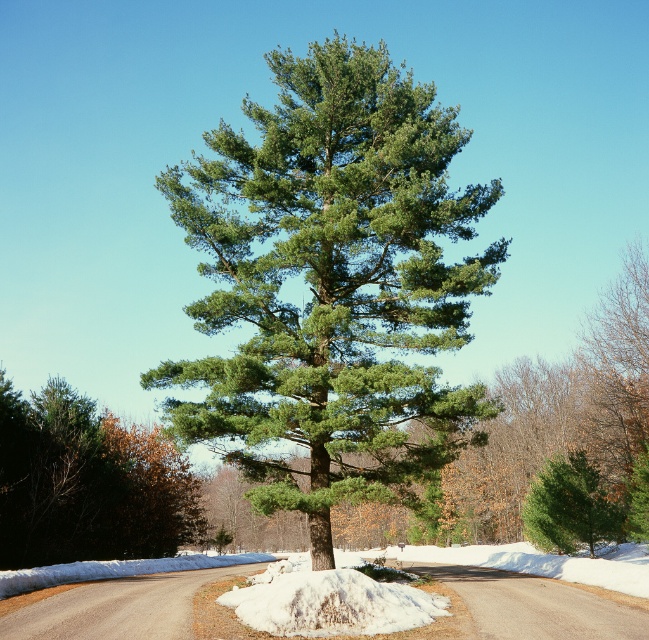
Is green matte tree at center to the right of green matte evergreen tree at center from the viewer's perspective?

Incorrect, green matte tree at center is not on the right side of green matte evergreen tree at center.

Is green matte tree at center closer to the viewer compared to green matte evergreen tree at center?

No, it is behind green matte evergreen tree at center.

At what (x,y) coordinates should I click in order to perform the action: click on green matte tree at center. Please return your answer as a coordinate pair (x, y). This screenshot has height=640, width=649. Looking at the image, I should click on (86, 483).

Does green needle-like at center have a lesser height compared to green matte evergreen tree at center?

No.

Based on the photo, can you confirm if green needle-like at center is positioned to the left of green matte evergreen tree at center?

Correct, you'll find green needle-like at center to the left of green matte evergreen tree at center.

What are the coordinates of `green needle-like at center` in the screenshot? It's located at (332, 285).

How far apart are green needle-like at center and green matte tree at center?

green needle-like at center is 13.42 meters from green matte tree at center.

At what (x,y) coordinates should I click in order to perform the action: click on green needle-like at center. Please return your answer as a coordinate pair (x, y). Looking at the image, I should click on (332, 285).

Image resolution: width=649 pixels, height=640 pixels. What do you see at coordinates (332, 285) in the screenshot? I see `green needle-like at center` at bounding box center [332, 285].

Where is `green needle-like at center`? The image size is (649, 640). green needle-like at center is located at coordinates point(332,285).